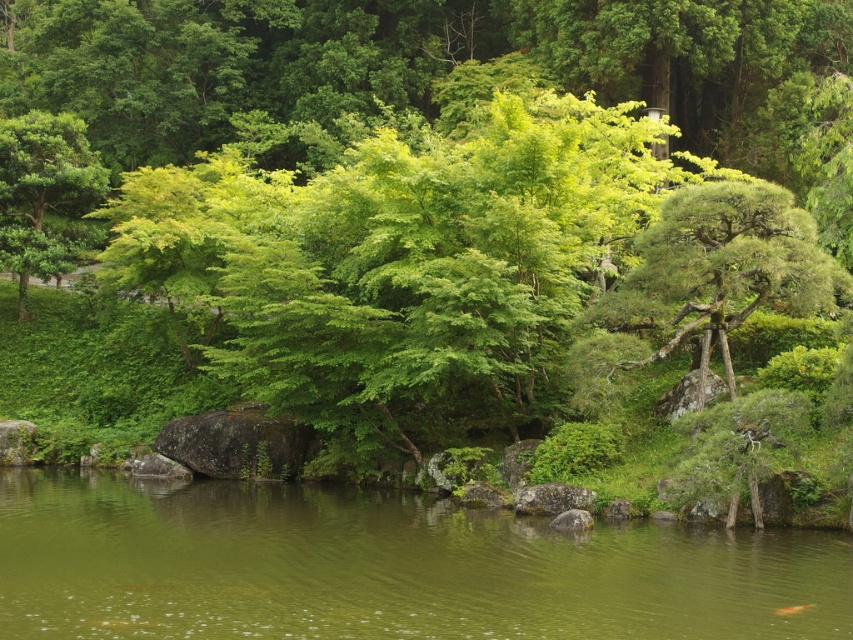
Question: Can you confirm if green water at center is bigger than green leafy tree at left?

Choices:
 (A) yes
 (B) no

Answer: (A)

Question: Which object appears closest to the camera in this image?

Choices:
 (A) green water at center
 (B) green leafy tree at left

Answer: (A)

Question: Does green water at center have a larger size compared to green leafy tree at left?

Choices:
 (A) no
 (B) yes

Answer: (B)

Question: Which of the following is the closest to the observer?

Choices:
 (A) green leafy tree at left
 (B) green water at center

Answer: (B)

Question: Which point is closer to the camera?

Choices:
 (A) (33, 588)
 (B) (51, 124)

Answer: (A)

Question: Can you confirm if green water at center is positioned above green leafy tree at left?

Choices:
 (A) no
 (B) yes

Answer: (A)